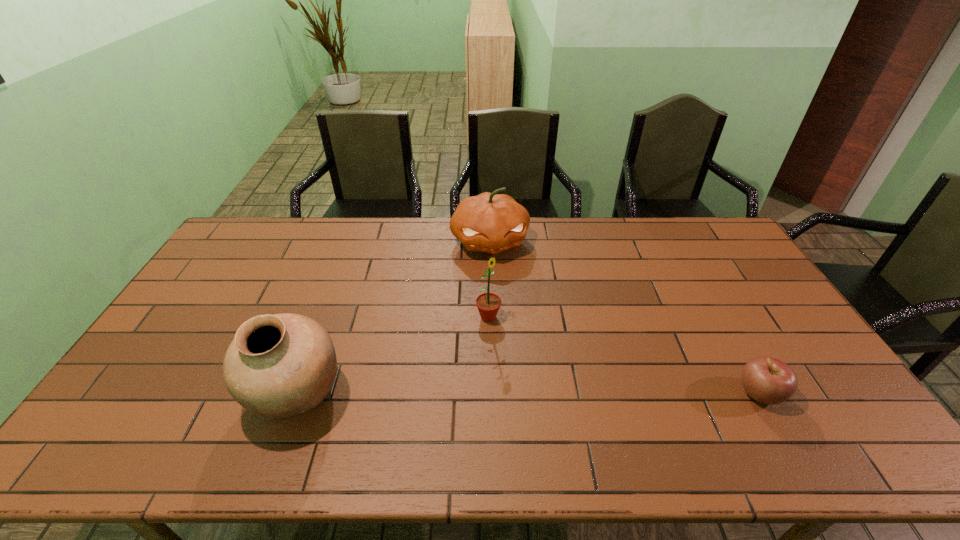
What are the coordinates of `vacant space located 0.290m on the front face of the pumpkin` in the screenshot? It's located at (513, 327).

Locate an element on the screen. The height and width of the screenshot is (540, 960). vacant area situated on the front face of the pumpkin is located at coordinates (517, 345).

Identify the location of free space located 0.180m on the front face of the pumpkin. This screenshot has width=960, height=540. (506, 301).

Where is `object at the far edge`? This screenshot has width=960, height=540. object at the far edge is located at coordinates (489, 222).

Where is `pottery at the near edge`? Image resolution: width=960 pixels, height=540 pixels. pottery at the near edge is located at coordinates (279, 366).

The width and height of the screenshot is (960, 540). What are the coordinates of `apple present at the near edge` in the screenshot? It's located at (767, 380).

Where is `object at the right edge`? The height and width of the screenshot is (540, 960). object at the right edge is located at coordinates (767, 380).

Find the location of a particular element. Image resolution: width=960 pixels, height=540 pixels. object positioned at the near right corner is located at coordinates (767, 380).

The height and width of the screenshot is (540, 960). Identify the location of free space at the far edge of the desktop. (351, 238).

At what (x,y) coordinates should I click in order to perform the action: click on free space at the near edge of the desktop. Please return your answer as a coordinate pair (x, y). Image resolution: width=960 pixels, height=540 pixels. Looking at the image, I should click on (548, 407).